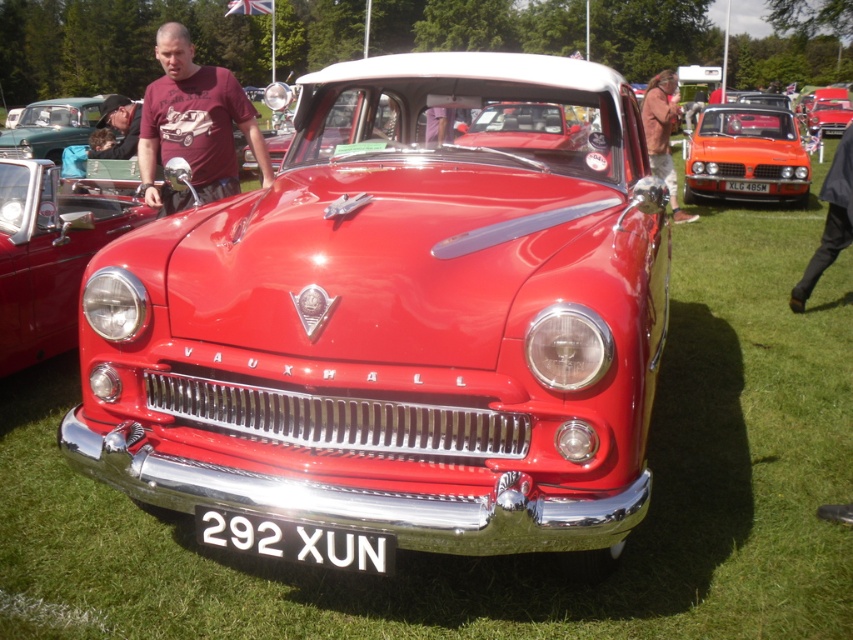
Looking at this image, can you confirm if shiny chrome headlight at center is positioned above glossy red car at center?

No.

Who is taller, shiny chrome headlight at center or glossy red car at center?

shiny chrome headlight at center is taller.

The width and height of the screenshot is (853, 640). Identify the location of shiny chrome headlight at center. (48, 257).

Between shiny red car at center and shiny chrome headlight at center, which one has more height?

Standing taller between the two is shiny red car at center.

Between shiny red car at center and shiny chrome headlight at center, which one appears on the right side from the viewer's perspective?

Positioned to the right is shiny red car at center.

Find the location of a particular element. This screenshot has height=640, width=853. shiny red car at center is located at coordinates (397, 323).

Can you confirm if glossy red car at center is positioned to the right of brown leather jacket at upper center?

In fact, glossy red car at center is to the left of brown leather jacket at upper center.

Does glossy red car at center lie in front of brown leather jacket at upper center?

Yes, it is.

Find the location of a particular element. Image resolution: width=853 pixels, height=640 pixels. glossy red car at center is located at coordinates (525, 125).